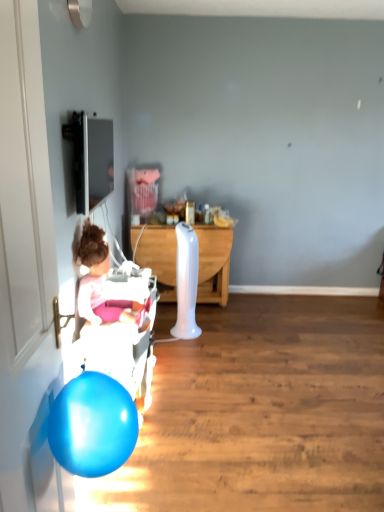
Measure the distance between point (82,291) and camera.

The distance of point (82,291) from camera is 6.95 feet.

Describe the element at coordinates (91, 158) in the screenshot. This screenshot has height=512, width=384. I see `matte black tv at upper left` at that location.

Describe the element at coordinates (23, 238) in the screenshot. I see `white glossy door at left` at that location.

Find the location of a particular element. pink fabric at left is located at coordinates coord(99,283).

Which is behind, point (94, 161) or point (95, 322)?

The point (94, 161) is behind.

Is matte black tv at upper left inside or outside of pink fabric at left?

matte black tv at upper left lies outside pink fabric at left.

From the image's perspective, which object appears higher, matte black tv at upper left or pink fabric at left?

From the image's view, matte black tv at upper left is above.

Which of these two, matte black tv at upper left or pink fabric at left, is smaller?

matte black tv at upper left is smaller.

Find the location of a particular element. Image resolution: width=384 pixels, height=512 pixels. balloon on the right of white glossy door at left is located at coordinates (92, 425).

Does glossy blue balloon at lower left turn towards white glossy door at left?

No, glossy blue balloon at lower left does not turn towards white glossy door at left.

Considering the relative sizes of glossy blue balloon at lower left and white glossy door at left in the image provided, is glossy blue balloon at lower left thinner than white glossy door at left?

No, glossy blue balloon at lower left is not thinner than white glossy door at left.

Is glossy blue balloon at lower left not inside white glossy door at left?

Yes, glossy blue balloon at lower left is outside of white glossy door at left.

Is matte black tv at upper left directly adjacent to white plastic baby carriage at left?

matte black tv at upper left and white plastic baby carriage at left are clearly separated.

Can you confirm if matte black tv at upper left is wider than white plastic baby carriage at left?

Incorrect, the width of matte black tv at upper left does not surpass that of white plastic baby carriage at left.

Between matte black tv at upper left and white plastic baby carriage at left, which one is positioned behind?

white plastic baby carriage at left.

Is white plastic baby carriage at left wider or thinner than white glossy door at left?

Considering their sizes, white plastic baby carriage at left looks broader than white glossy door at left.

From a real-world perspective, between white plastic baby carriage at left and white glossy door at left, who is vertically higher?

white glossy door at left.

Between white plastic baby carriage at left and white glossy door at left, which one has less height?

white plastic baby carriage at left.

Between matte black tv at upper left and glossy blue balloon at lower left, which one has smaller size?

glossy blue balloon at lower left.

Can you confirm if matte black tv at upper left is shorter than glossy blue balloon at lower left?

Incorrect, the height of matte black tv at upper left does not fall short of that of glossy blue balloon at lower left.

Between point (86, 119) and point (58, 403), which one is positioned in front?

The point (58, 403) is closer.

Which is more distant, (x=87, y=472) or (x=91, y=343)?

Point (x=91, y=343)

Is the depth of glossy blue balloon at lower left less than that of white plastic baby carriage at left?

Yes, glossy blue balloon at lower left is in front of white plastic baby carriage at left.

From a real-world perspective, is glossy blue balloon at lower left beneath white plastic baby carriage at left?

No, from a real-world perspective, glossy blue balloon at lower left is not beneath white plastic baby carriage at left.

Is glossy blue balloon at lower left taller or shorter than white plastic baby carriage at left?

Clearly, glossy blue balloon at lower left is shorter compared to white plastic baby carriage at left.

Is pink fabric at left surrounded by glossy blue balloon at lower left?

No, glossy blue balloon at lower left does not contain pink fabric at left.

Does glossy blue balloon at lower left appear on the right side of pink fabric at left?

Yes.

Is glossy blue balloon at lower left taller or shorter than pink fabric at left?

Considering their sizes, glossy blue balloon at lower left has less height than pink fabric at left.

Identify the location of television above the pink fabric at left (from a real-world perspective). (91, 158).

This screenshot has width=384, height=512. Find the location of `balloon that is behind the white glossy door at left`. balloon that is behind the white glossy door at left is located at coordinates (92, 425).

Based on the photo, estimate the real-world distances between objects in this image. Which object is further from glossy blue balloon at lower left, white wood desk at center or pink fabric at left?

white wood desk at center lies further to glossy blue balloon at lower left than the other object.

When comparing their distances from white plastic baby carriage at left, does white wood desk at center or white glossy door at left seem closer?

The object closer to white plastic baby carriage at left is white glossy door at left.

Estimate the real-world distances between objects in this image. Which object is further from matte black tv at upper left, white wood desk at center or glossy blue balloon at lower left?

Among the two, glossy blue balloon at lower left is located further to matte black tv at upper left.

Based on their spatial positions, is white wood desk at center or white glossy door at left further from matte black tv at upper left?

white glossy door at left is positioned further to the anchor matte black tv at upper left.

Based on their spatial positions, is white glossy door at left or white plastic baby carriage at left closer to glossy blue balloon at lower left?

white glossy door at left is positioned closer to the anchor glossy blue balloon at lower left.

Based on their spatial positions, is glossy blue balloon at lower left or pink fabric at left closer to matte black tv at upper left?

Based on the image, pink fabric at left appears to be nearer to matte black tv at upper left.

Looking at the image, which one is located further to pink fabric at left, white glossy door at left or glossy blue balloon at lower left?

white glossy door at left lies further to pink fabric at left than the other object.

Which object lies further to the anchor point white plastic baby carriage at left, white wood desk at center or glossy blue balloon at lower left?

Based on the image, white wood desk at center appears to be further to white plastic baby carriage at left.

Where is `person between matte black tv at upper left and white wood desk at center along the z-axis`? The image size is (384, 512). person between matte black tv at upper left and white wood desk at center along the z-axis is located at coordinates (99, 283).

I want to click on baby carriage that lies between matte black tv at upper left and glossy blue balloon at lower left from top to bottom, so click(x=111, y=321).

Where is `baby carriage between matte black tv at upper left and white wood desk at center in the front-back direction`? This screenshot has width=384, height=512. baby carriage between matte black tv at upper left and white wood desk at center in the front-back direction is located at coordinates (111, 321).

At what (x,y) coordinates should I click in order to perform the action: click on balloon located between white glossy door at left and white plastic baby carriage at left in the depth direction. Please return your answer as a coordinate pair (x, y). Looking at the image, I should click on (92, 425).